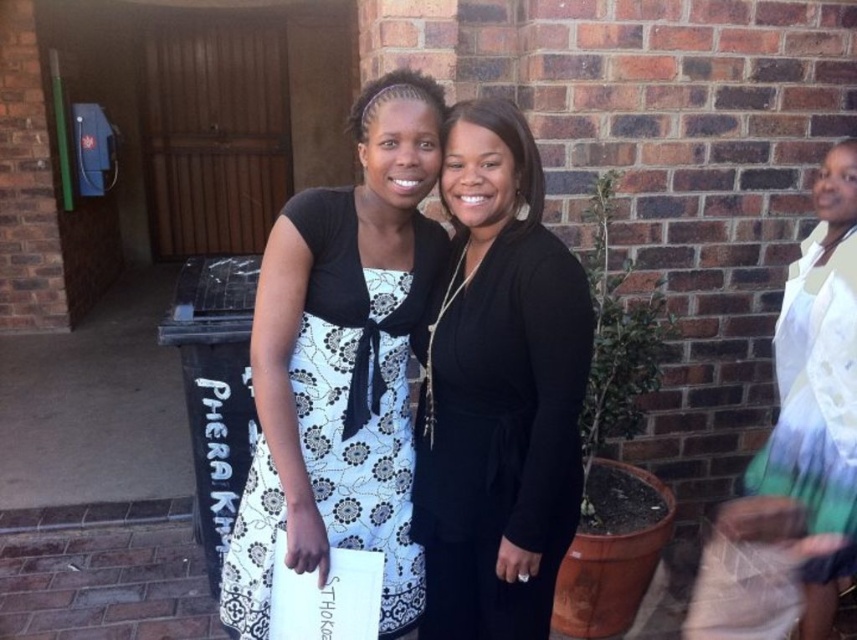
You are a photographer setting up a shoot in this scene. You need to position a light source to the right of the white textured dress at right and to the left of the black matte dress at center. Is this possible given their positions?

The black matte dress at center is to the left of the white textured dress at right, so placing a light source to the right of the white textured dress at right and to the left of the black matte dress at center is not possible because the black matte dress at center is already positioned to the left of the white textured dress at right.

You are a photographer trying to capture the two women in the scene. The point at coordinate (358, 388) is important for your composition. Which object in the scene is this point located on?

The point at coordinate (358, 388) is located on the white floral dress at center.

Looking at this image, you are a photographer trying to capture a photo of the black matte dress at center and the white textured dress at right. Since you want to ensure both dresses are visible in the frame, which dress should you focus on first to maintain proper focus given their positions?

The black matte dress at center should be focused on first because it is located above the white textured dress at right, so adjusting focus starting from the higher position ensures both can be in the frame.